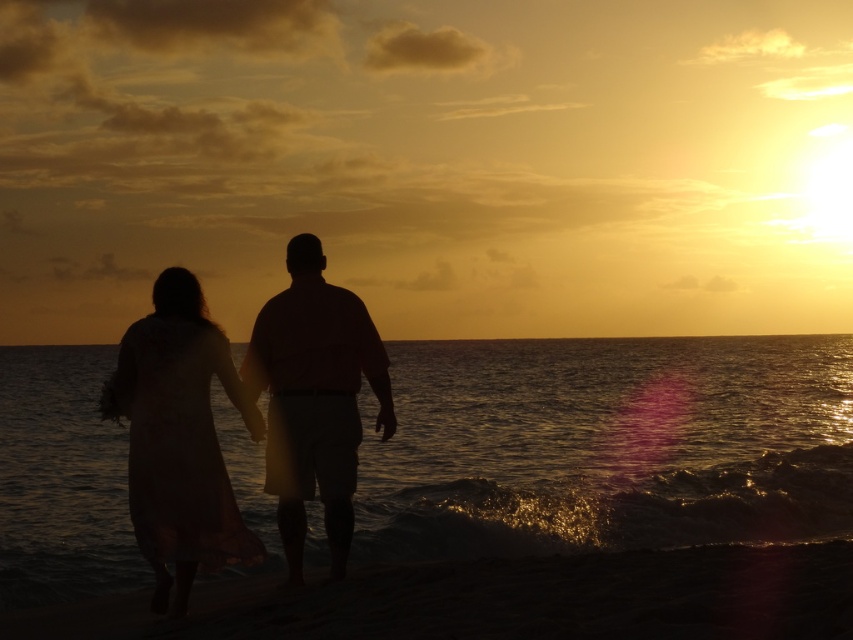
Question: Which object is positioned closest to the glistening water at lower center?

Choices:
 (A) matte pink shirt at center
 (B) silky white dress at lower left

Answer: (A)

Question: Observing the image, what is the correct spatial positioning of silky white dress at lower left in reference to matte pink shirt at center?

Choices:
 (A) right
 (B) left

Answer: (B)

Question: Does silky white dress at lower left appear on the left side of matte pink shirt at center?

Choices:
 (A) no
 (B) yes

Answer: (B)

Question: Is the position of silky white dress at lower left less distant than that of matte pink shirt at center?

Choices:
 (A) no
 (B) yes

Answer: (B)

Question: Which point is closer to the camera?

Choices:
 (A) silky white dress at lower left
 (B) matte pink shirt at center

Answer: (A)

Question: Based on their relative distances, which object is nearer to the glistening water at lower center?

Choices:
 (A) matte pink shirt at center
 (B) silky white dress at lower left

Answer: (A)